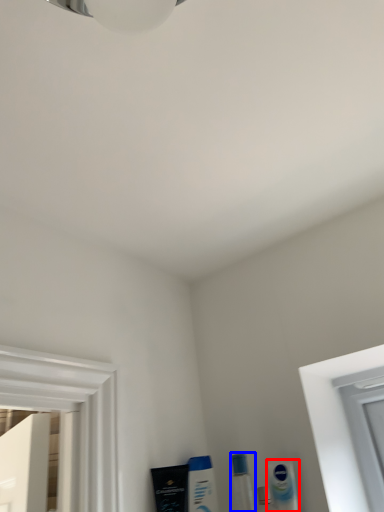
Question: Which of the following is the closest to the observer, mouthwash (highlighted by a red box) or toiletry (highlighted by a blue box)?

Choices:
 (A) mouthwash
 (B) toiletry

Answer: (B)